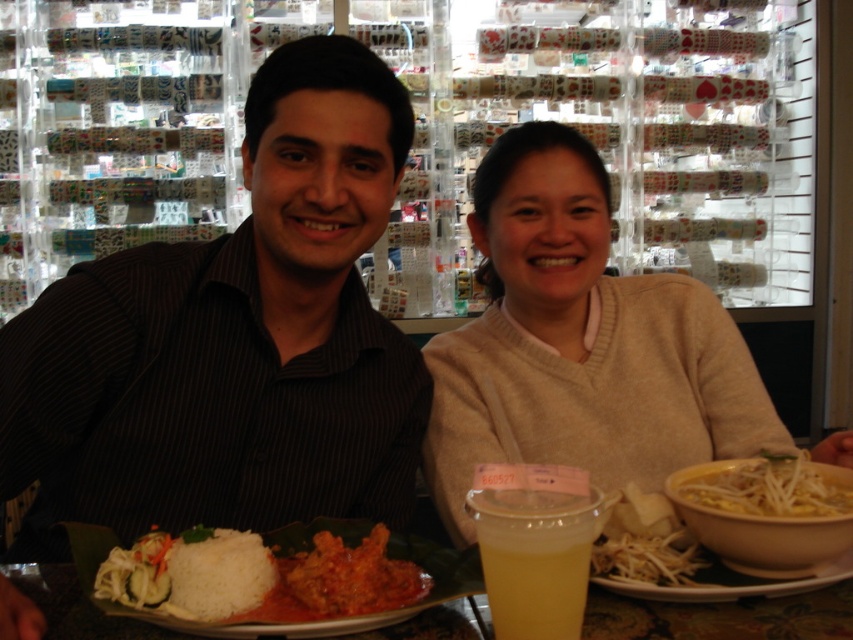
You are standing in front of the table and want to place a small vase exactly at point (317, 618). The vase is 3 inches tall. Will the vase be visible from your current position?

The distance of point (317, 618) from camera is 28.90 inches, so the vase placed there will be visible from your current position since it is within the camera view range.

Consider the image. You are a server at a restaurant and need to place a new dish on the table between the white matte rice at center and the translucent plastic cup at center. Which object should you move to make space?

The white matte rice at center is wider than the translucent plastic cup at center, so you should move the white matte rice at center to create more space.

You are a waiter who needs to place a new drink order on the table. The table already has a white matte rice at center and a translucent plastic cup at center. Which object should you place the drink on top of, considering their heights?

The white matte rice at center is not as tall as the translucent plastic cup at center, so you should place the drink on top of the translucent plastic cup at center since it is taller and more stable.